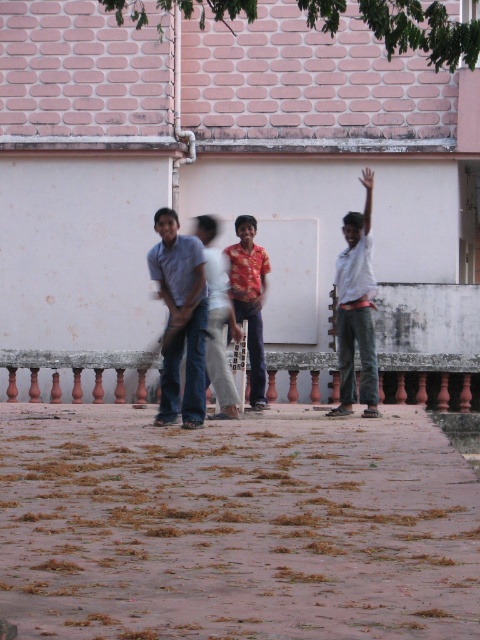
You are a photographer trying to capture a candid shot of the person wearing the matte blue shirt at center and white cotton pants at center. Since you want to focus on their upper body, should you adjust your camera to focus on the upper or lower part of the person?

The matte blue shirt at center is located below white cotton pants at center, so the white cotton pants at center are higher up. To focus on the upper body, adjust the camera to focus on the upper part where the white cotton pants at center are located.

You are a photographer trying to capture a photo of the shiny red shirt at center and the white cotton pants at center. Since you want to ensure both are visible, which object should you focus on first considering their heights?

The shiny red shirt at center has a greater height compared to white cotton pants at center, so you should focus on the shiny red shirt at center first to ensure it is in clear view before adjusting for the white cotton pants at center.

You are standing at the point marked as point (235, 525) in the image. What is the surface you are currently standing on?

The point (235, 525) is on brown dirt at lower center, so you are standing on brown dirt.